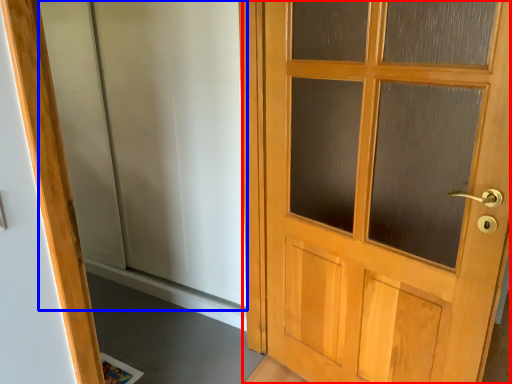
Question: Which point is closer to the camera, door (highlighted by a red box) or elevator (highlighted by a blue box)?

Choices:
 (A) door
 (B) elevator

Answer: (A)